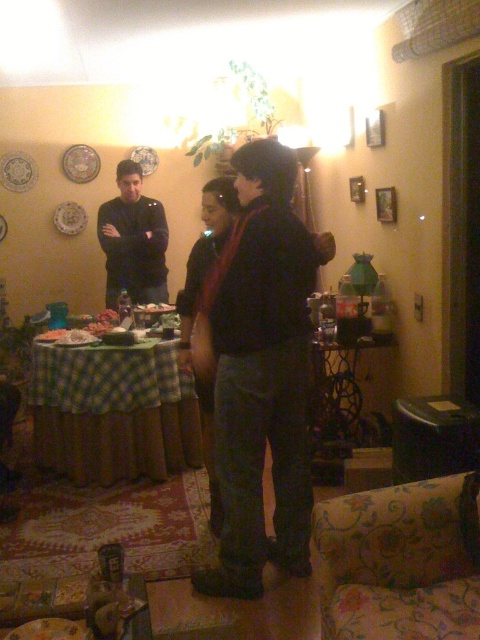
Is point (233, 564) positioned behind point (127, 180)?

No.

Does point (242, 212) come closer to viewer compared to point (127, 259)?

Yes, it is.

This screenshot has height=640, width=480. What are the coordinates of `dark gray pants at center` in the screenshot? It's located at (260, 371).

Can you confirm if dark gray pants at center is shorter than green checkered tablecloth at center?

Incorrect, dark gray pants at center's height does not fall short of green checkered tablecloth at center's.

Which is below, dark gray pants at center or green checkered tablecloth at center?

green checkered tablecloth at center

The image size is (480, 640). In order to click on dark gray pants at center in this screenshot , I will do `click(260, 371)`.

Does green checkered tablecloth at center lie in front of black matte shirt at center?

Yes, it is.

Which is below, green checkered tablecloth at center or black matte shirt at center?

green checkered tablecloth at center is lower down.

The image size is (480, 640). What do you see at coordinates (112, 412) in the screenshot?
I see `green checkered tablecloth at center` at bounding box center [112, 412].

In order to click on green checkered tablecloth at center in this screenshot , I will do click(112, 412).